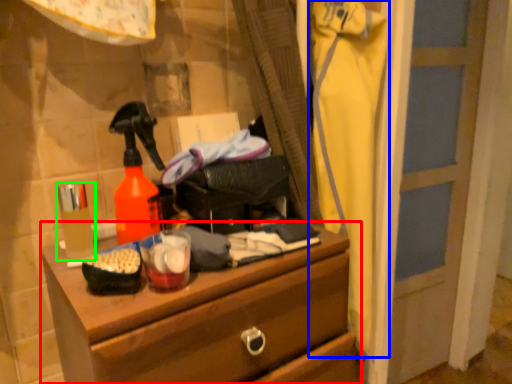
Question: Considering the real-world distances, which object is farthest from chest of drawers (highlighted by a red box)? clothing (highlighted by a blue box) or toiletry (highlighted by a green box)?

Choices:
 (A) clothing
 (B) toiletry

Answer: (A)